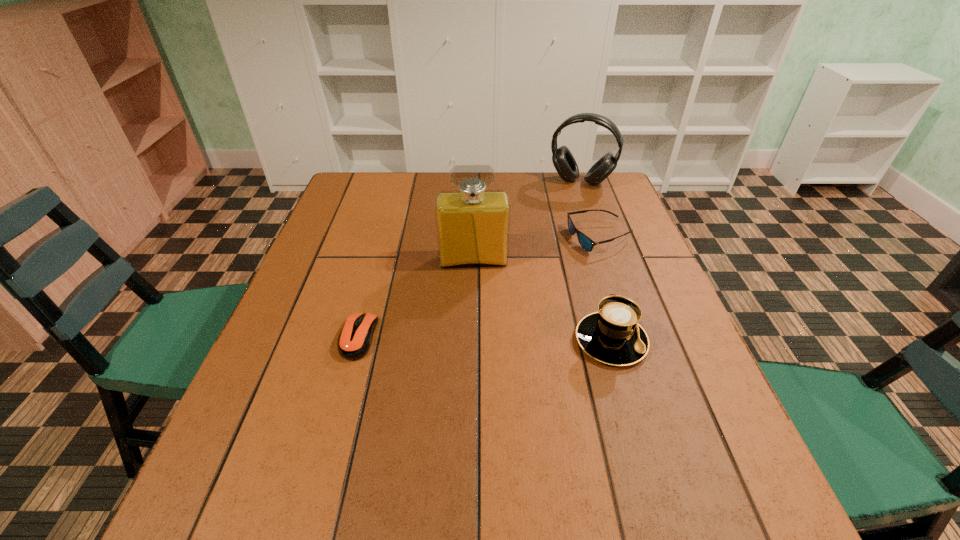
Find the location of a particular element. vacant region that satisfies the following two spatial constraints: 1. on the back side of the perfume; 2. on the right side of the fourth shortest object is located at coordinates (475, 181).